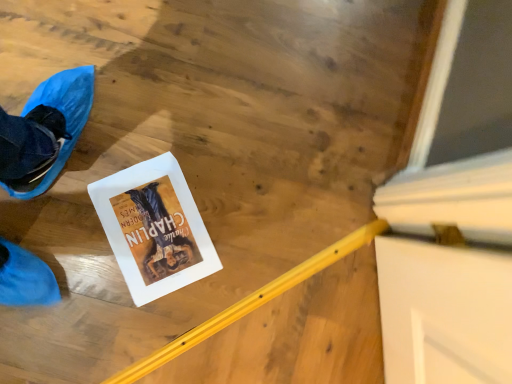
This screenshot has height=384, width=512. In order to click on free point behind white paper book cover at center in this screenshot , I will do `click(216, 150)`.